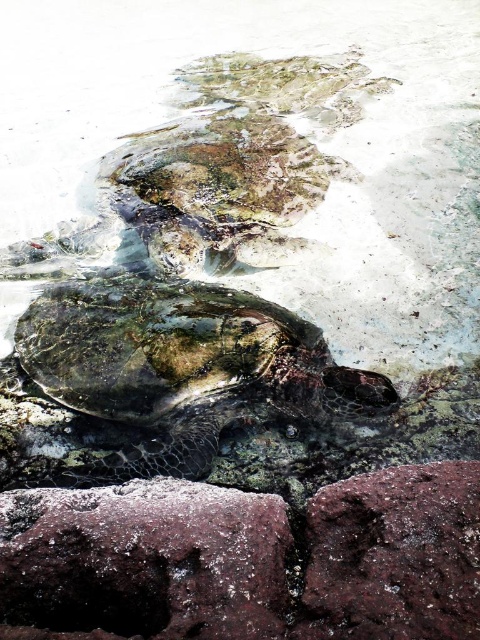
Question: Among these points, which one is farthest from the camera?

Choices:
 (A) [178, 524]
 (B) [338, 548]
 (C) [169, 307]

Answer: (C)

Question: Is shiny green turtle at center smaller than rusty metallic rock at lower right?

Choices:
 (A) yes
 (B) no

Answer: (B)

Question: Can you confirm if rusty metallic rock at lower left is wider than textured brownish-green shell at upper center?

Choices:
 (A) no
 (B) yes

Answer: (A)

Question: Which point is farther to the camera?

Choices:
 (A) (117, 515)
 (B) (232, 113)
 (C) (151, 308)

Answer: (B)

Question: Is textured brownish-green shell at upper center positioned before rusty metallic rock at lower right?

Choices:
 (A) yes
 (B) no

Answer: (B)

Question: Which is nearer to the rusty metallic rock at lower right?

Choices:
 (A) rusty metallic rock at lower left
 (B) shiny green turtle at center
 (C) textured brownish-green shell at upper center

Answer: (A)